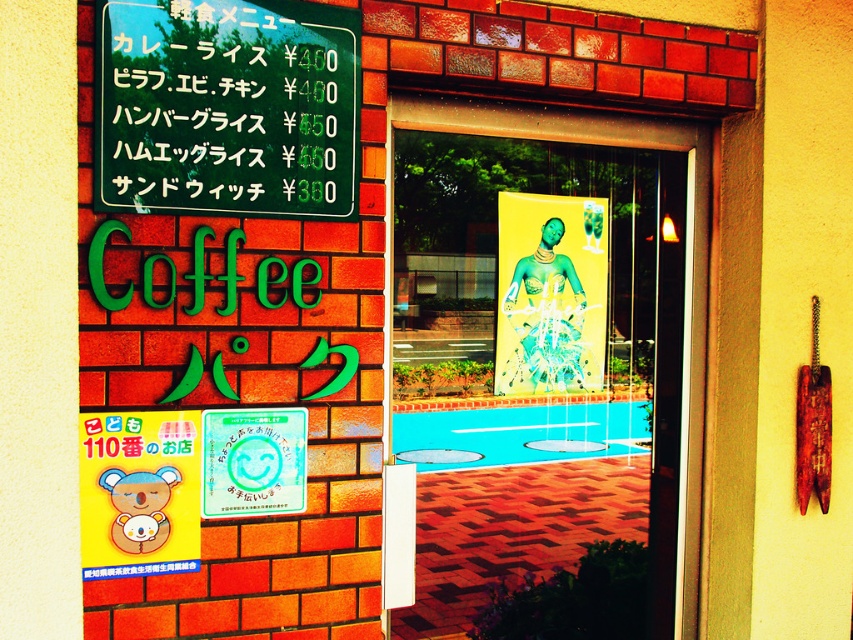
You are standing in front of the Coffee Park cafe and notice two points marked on the exterior wall. The first point is at coordinates point (624, 140) and the second is at point (125, 538). Which point is closer to you?

Point (624, 140) is further to the viewer than point (125, 538), so the point closer to you is point (125, 538).

You are a delivery person trying to see inside the Coffee Park cafe. You notice the translucent glass window at center and the white glossy signboard at upper center. Which object would allow you to see the interior of the cafe better?

The translucent glass window at center is wider than the white glossy signboard at upper center, so it allows a better view of the interior.

You are a delivery person trying to see the menu clearly through the translucent glass window at center and the green plastic menu board at upper left. Which object has a smaller width?

The translucent glass window at center has a lesser width compared to the green plastic menu board at upper left, so the translucent glass window at center has a smaller width.